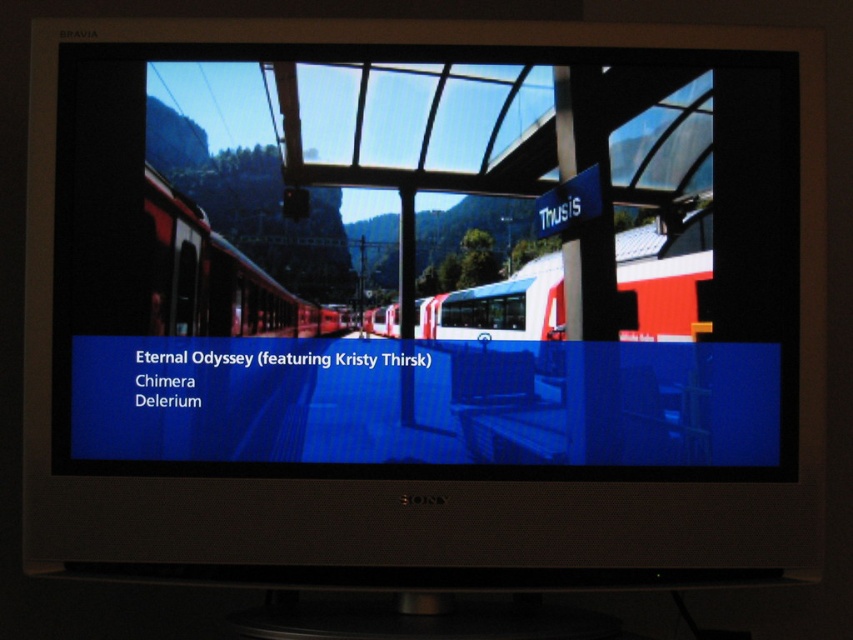
Between matte black screen at center and matte red train at left, which one is positioned lower?

matte red train at left is below.

From the picture: Which of these two, matte black screen at center or matte red train at left, stands shorter?

Standing shorter between the two is matte red train at left.

Who is more distant from viewer, (747, 230) or (202, 208)?

The point (202, 208) is behind.

At what (x,y) coordinates should I click in order to perform the action: click on matte black screen at center. Please return your answer as a coordinate pair (x, y). This screenshot has width=853, height=640. Looking at the image, I should click on (422, 266).

Between point (622, 243) and point (189, 237), which one is positioned in front?

Positioned in front is point (189, 237).

Is white glossy train at center behind matte red train at left?

Yes, it is.

Is point (641, 289) positioned after point (260, 269)?

Yes, it is.

Find the location of a particular element. white glossy train at center is located at coordinates (663, 278).

Does matte black screen at center have a greater height compared to red matte train at center?

Indeed, matte black screen at center has a greater height compared to red matte train at center.

Is matte black screen at center closer to the viewer compared to red matte train at center?

Yes, it is.

Does point (605, 404) come closer to viewer compared to point (251, 326)?

No, (605, 404) is further to viewer.

Identify the location of matte black screen at center. The image size is (853, 640). (422, 266).